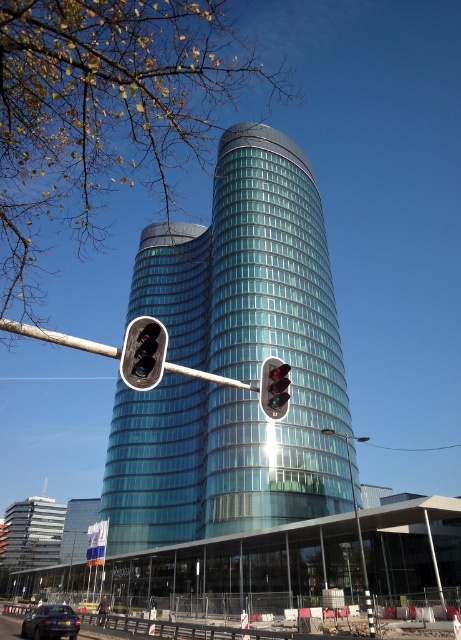
You are standing at the base of the glassy teal skyscraper at center. You want to walk to the traffic light pole that is diagonally across the frame. How far will you have to walk?

The glassy teal skyscraper at center is 40.61 meters away from the viewer, so you would need to walk approximately 40.61 meters to reach the traffic light pole diagonally across the frame.

You are a delivery drone that needs to fly between the two traffic lights. The drone has a wingspan of 3 meters. Can it safely pass between the matte black traffic light at center and the green glass traffic light at center without touching either?

The distance between the matte black traffic light at center and the green glass traffic light at center is 3.78 meters. Since the drone has a wingspan of 3 meters, there is enough space for it to pass safely between them as 3.78 meters is greater than 3 meters.

You are a pedestrian waiting at the crosswalk and see both the matte black traffic light at center and the green glass traffic light at center. Which traffic light is positioned higher in the scene?

The matte black traffic light at center is positioned higher than the green glass traffic light at center.